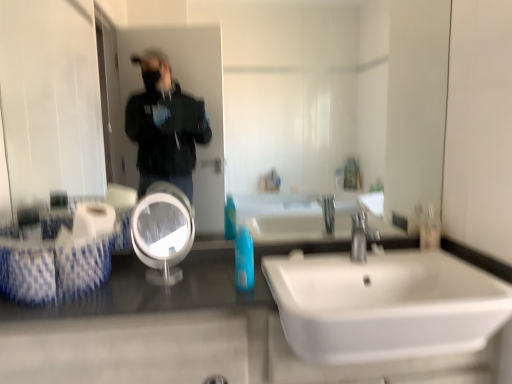
You are a GUI agent. You are given a task and a screenshot of the screen. Output one action in this format:
    pyautogui.click(x=<x>, y=<y>)
    Task: Click on the vacant area located to the right-hand side of satin nickel faucet at center
    
    Given the screenshot: What is the action you would take?
    pyautogui.click(x=416, y=254)